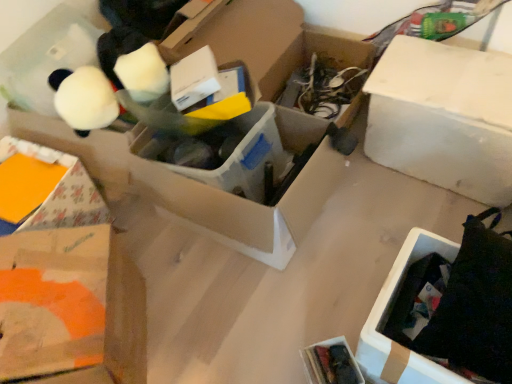
Where is `free space that is to the left of white matte box at upper right`? The image size is (512, 384). free space that is to the left of white matte box at upper right is located at coordinates (368, 205).